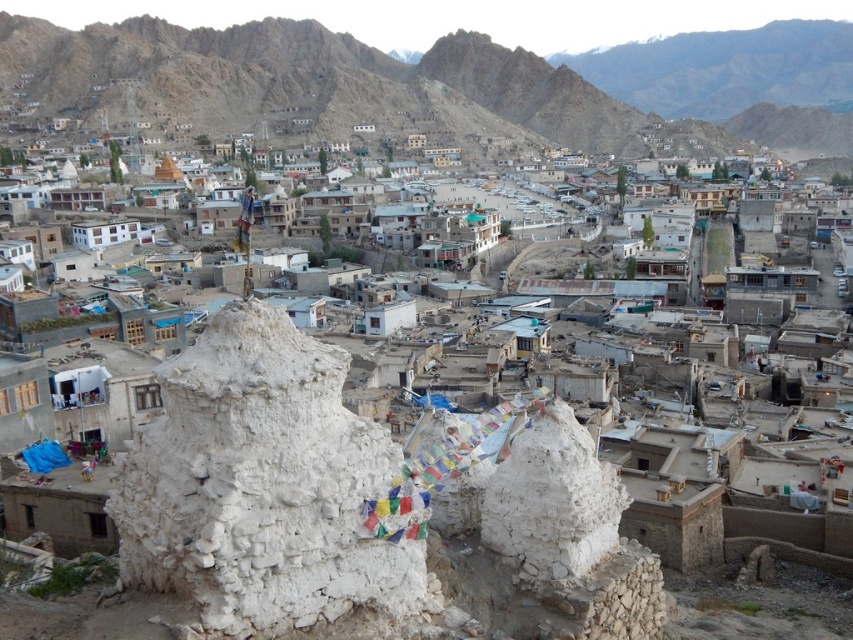
You are a hiker who has just arrived at the town and wants to take a photo of the white clay stupa at center and the rugged stone mountain at upper center. Which object should you focus on first if you want to capture both in the same frame?

You should focus on the rugged stone mountain at upper center first because the white clay stupa at center is located below it, so adjusting the camera angle to include both would require framing from the mountain downward.

You are a hiker planning to reach the rugged stone mountain at upper center from the town below. Based on the image, what is the most direct path you should take?

The rugged stone mountain at upper center is located at point coordinates, so the most direct path would be to head towards the coordinates provided in the image.